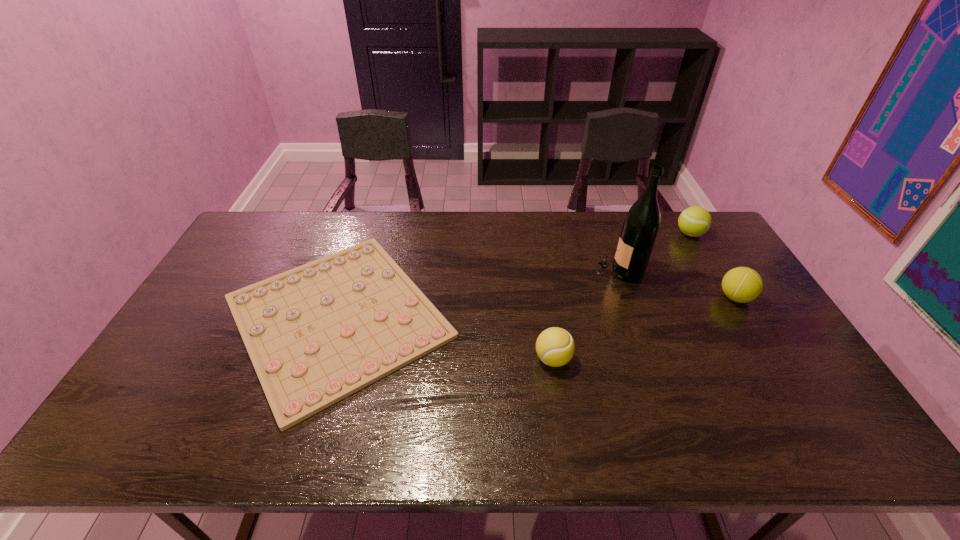
The height and width of the screenshot is (540, 960). Find the location of `free spot between the farthest tennis ball and the tallest object`. free spot between the farthest tennis ball and the tallest object is located at coordinates (655, 252).

The image size is (960, 540). Find the location of `vacant area between the farthest tennis ball and the nearest tennis ball`. vacant area between the farthest tennis ball and the nearest tennis ball is located at coordinates (622, 296).

Where is `the third closest object to the second farthest tennis ball`? the third closest object to the second farthest tennis ball is located at coordinates (555, 347).

Select which object is the second closest to the farthest tennis ball. Please provide its 2D coordinates. Your answer should be formatted as a tuple, i.e. [(x, y)], where the tuple contains the x and y coordinates of a point satisfying the conditions above.

[(741, 284)]

Point out which tennis ball is positioned as the second nearest to the leftmost object. Please provide its 2D coordinates. Your answer should be formatted as a tuple, i.e. [(x, y)], where the tuple contains the x and y coordinates of a point satisfying the conditions above.

[(694, 221)]

Identify which tennis ball is the second closest to the second farthest tennis ball. Please provide its 2D coordinates. Your answer should be formatted as a tuple, i.e. [(x, y)], where the tuple contains the x and y coordinates of a point satisfying the conditions above.

[(555, 347)]

Identify the location of free location that satisfies the following two spatial constraints: 1. on the back side of the leftmost object; 2. on the right side of the third object from right to left. (353, 269).

Locate an element on the screen. The image size is (960, 540). vacant space that satisfies the following two spatial constraints: 1. on the front side of the second nearest tennis ball; 2. on the right side of the farthest tennis ball is located at coordinates (728, 298).

Where is `vacant space that satisfies the following two spatial constraints: 1. on the back side of the leftmost tennis ball; 2. on the left side of the farthest tennis ball`? vacant space that satisfies the following two spatial constraints: 1. on the back side of the leftmost tennis ball; 2. on the left side of the farthest tennis ball is located at coordinates (534, 234).